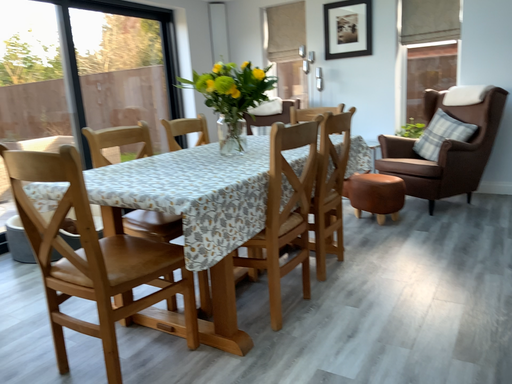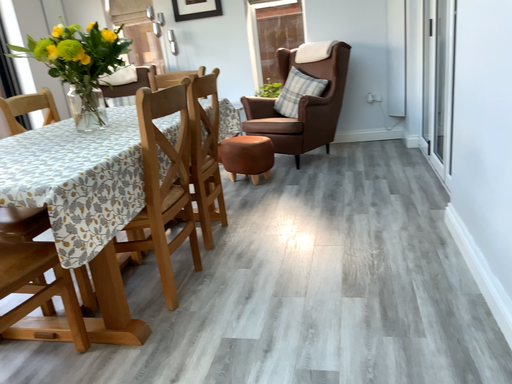
Question: How did the camera likely rotate when shooting the video?

Choices:
 (A) rotated right
 (B) rotated left

Answer: (A)